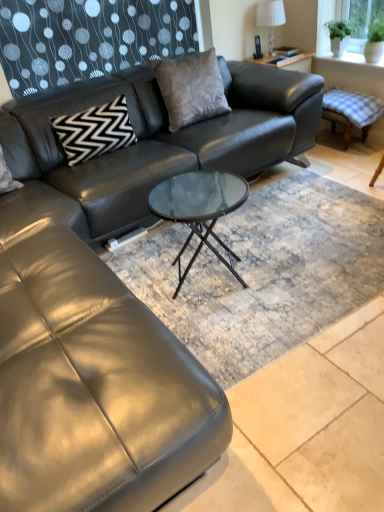
Question: Considering the relative positions of checkered fabric swivel chair at right and white fabric lampshade at upper right in the image provided, is checkered fabric swivel chair at right to the left of white fabric lampshade at upper right from the viewer's perspective?

Choices:
 (A) yes
 (B) no

Answer: (B)

Question: Is checkered fabric swivel chair at right to the right of white fabric lampshade at upper right from the viewer's perspective?

Choices:
 (A) yes
 (B) no

Answer: (A)

Question: Is checkered fabric swivel chair at right thinner than white fabric lampshade at upper right?

Choices:
 (A) yes
 (B) no

Answer: (B)

Question: From a real-world perspective, is checkered fabric swivel chair at right below white fabric lampshade at upper right?

Choices:
 (A) yes
 (B) no

Answer: (A)

Question: Can you confirm if checkered fabric swivel chair at right is shorter than white fabric lampshade at upper right?

Choices:
 (A) no
 (B) yes

Answer: (B)

Question: Considering the positions of checkered fabric swivel chair at right and green glass window screen at upper right in the image, is checkered fabric swivel chair at right taller or shorter than green glass window screen at upper right?

Choices:
 (A) short
 (B) tall

Answer: (A)

Question: Is checkered fabric swivel chair at right wider or thinner than green glass window screen at upper right?

Choices:
 (A) thin
 (B) wide

Answer: (B)

Question: Considering the relative positions of checkered fabric swivel chair at right and green glass window screen at upper right in the image provided, is checkered fabric swivel chair at right to the left or to the right of green glass window screen at upper right?

Choices:
 (A) right
 (B) left

Answer: (B)

Question: In the image, is checkered fabric swivel chair at right positioned in front of or behind green glass window screen at upper right?

Choices:
 (A) behind
 (B) front

Answer: (A)

Question: Considering the positions of point (372, 114) and point (114, 128), is point (372, 114) closer or farther from the camera than point (114, 128)?

Choices:
 (A) farther
 (B) closer

Answer: (A)

Question: Considering the positions of checkered fabric swivel chair at right and black zigzag-patterned pillow at upper left, marked as the 2th pillow in a right-to-left arrangement, in the image, is checkered fabric swivel chair at right taller or shorter than black zigzag-patterned pillow at upper left, marked as the 2th pillow in a right-to-left arrangement,?

Choices:
 (A) tall
 (B) short

Answer: (B)

Question: From the image's perspective, is checkered fabric swivel chair at right located above or below black zigzag-patterned pillow at upper left, positioned as the 1th pillow in left-to-right order?

Choices:
 (A) below
 (B) above

Answer: (B)

Question: Is checkered fabric swivel chair at right bigger or smaller than black zigzag-patterned pillow at upper left, positioned as the 1th pillow in left-to-right order?

Choices:
 (A) small
 (B) big

Answer: (B)

Question: Is green glass window screen at upper right in front of or behind satin gray pillow at center, which ranks as the first pillow in right-to-left order, in the image?

Choices:
 (A) front
 (B) behind

Answer: (B)

Question: Considering the positions of green glass window screen at upper right and satin gray pillow at center, which ranks as the first pillow in right-to-left order, in the image, is green glass window screen at upper right taller or shorter than satin gray pillow at center, which ranks as the first pillow in right-to-left order,?

Choices:
 (A) short
 (B) tall

Answer: (A)